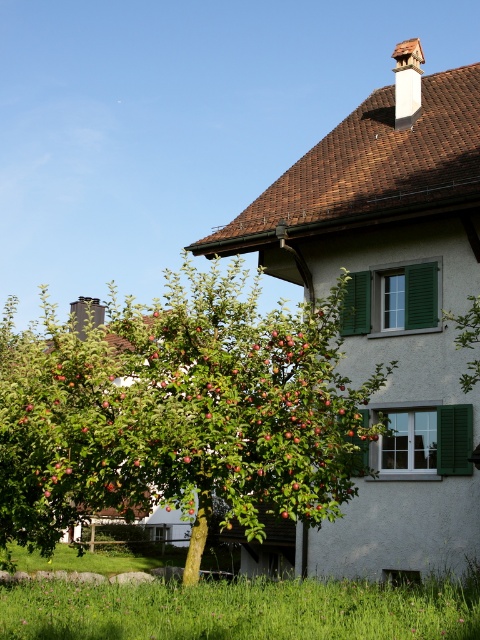
You are standing in front of the traditional European house and want to place a small garden ornament between the two points marked as point [332,484] and point [245,595]. Since you need to ensure the ornament is placed closer to the house, which point should you choose?

To place the garden ornament closer to the house, you should choose point [245,595] because it is closer to the viewer than point [332,484], which is further away.